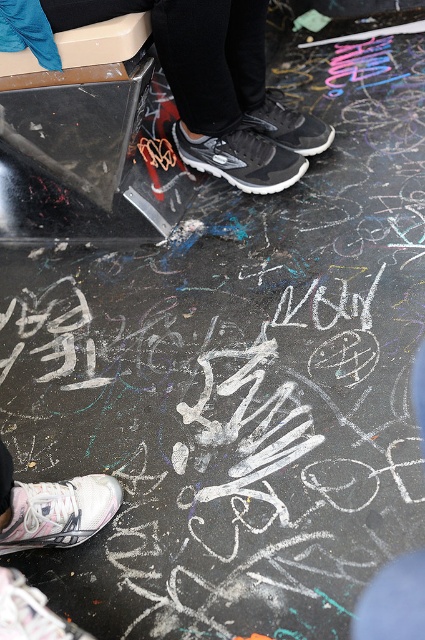
You are standing on the floor with chalk drawings and see both the white mesh shoe at lower left and the white mesh sneaker at lower left. Which one is positioned more to the left side?

The white mesh shoe at lower left is positioned more to the left side than the white mesh sneaker at lower left.

You are standing on the floor with colorful chalk drawings and see both the white mesh shoe at lower left and the white mesh sneaker at lower left. Which one has a higher height?

The white mesh shoe at lower left is taller than the white mesh sneaker at lower left.